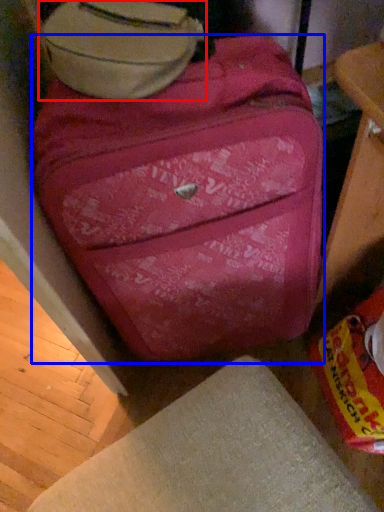
Question: Among these objects, which one is farthest to the camera, luggage (highlighted by a red box) or suitcase (highlighted by a blue box)?

Choices:
 (A) luggage
 (B) suitcase

Answer: (A)